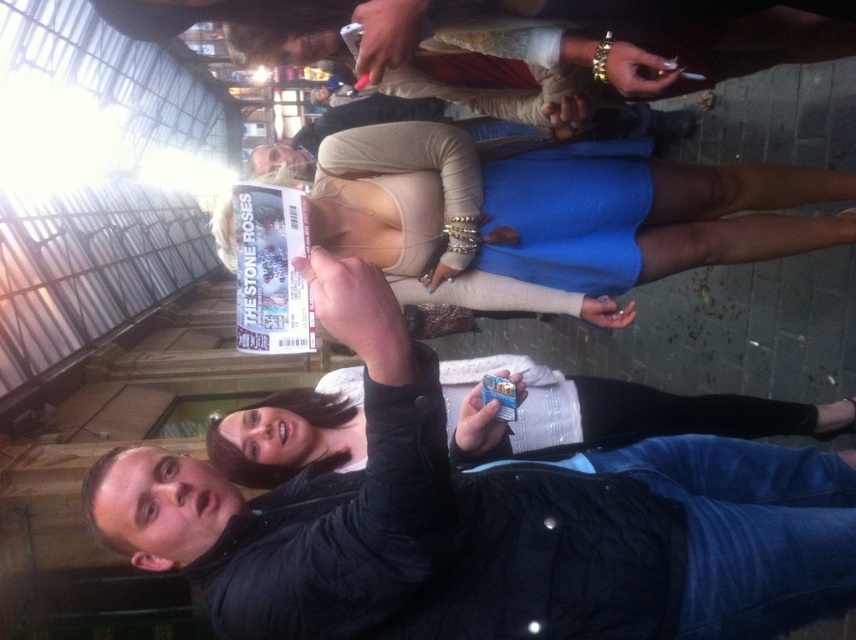
Question: Which of the following is the closest to the observer?

Choices:
 (A) matte black jacket at upper center
 (B) matte blue dress at center

Answer: (B)

Question: Is the position of matte blue dress at center more distant than that of matte black jacket at upper center?

Choices:
 (A) no
 (B) yes

Answer: (A)

Question: Which of the following is the farthest from the observer?

Choices:
 (A) (530, 129)
 (B) (408, 288)

Answer: (A)

Question: Where is matte blue dress at center located in relation to matte black jacket at upper center in the image?

Choices:
 (A) below
 (B) above

Answer: (A)

Question: Is matte blue dress at center below matte black jacket at upper center?

Choices:
 (A) yes
 (B) no

Answer: (A)